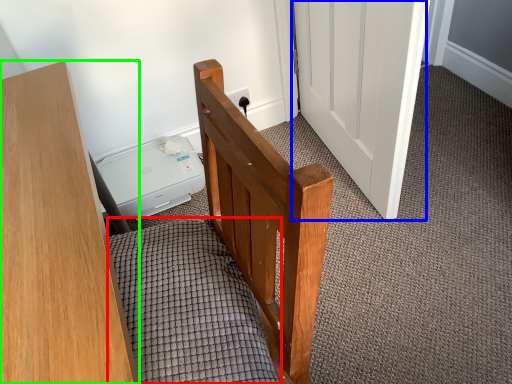
Question: Considering the real-world distances, which object is closest to bedding (highlighted by a red box)? door (highlighted by a blue box) or furniture (highlighted by a green box).

Choices:
 (A) door
 (B) furniture

Answer: (B)